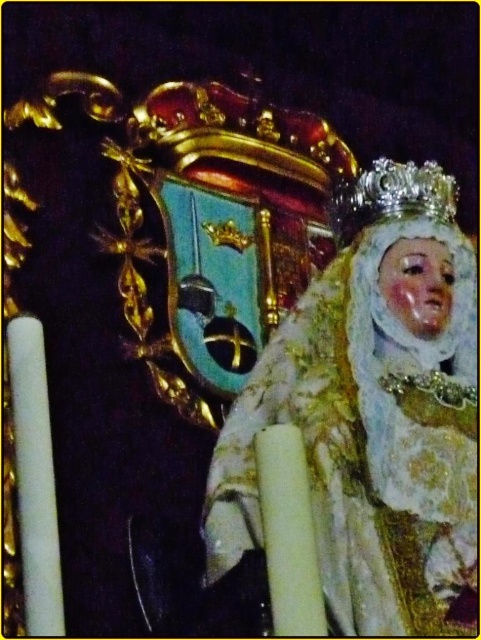
You are standing in a cathedral and see the porcelain statue at center. If your camera has a maximum focus range of 45 meters, will it be able to capture the statue clearly?

The porcelain statue at center is 47.24 meters away from the camera, which exceeds the maximum focus range of 45 meters. Therefore, the camera will not be able to capture the statue clearly.

You are an art restorer examining a religious statue. You notice a point at coordinates (374, 413). Based on the scene description, where is this point located on the statue?

The point at coordinates (374, 413) is located on the porcelain statue at center.